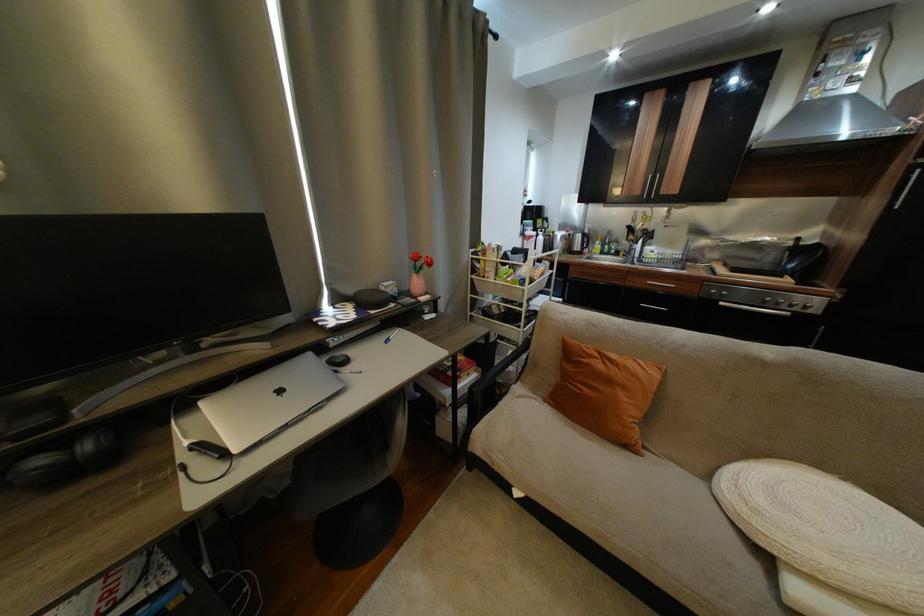
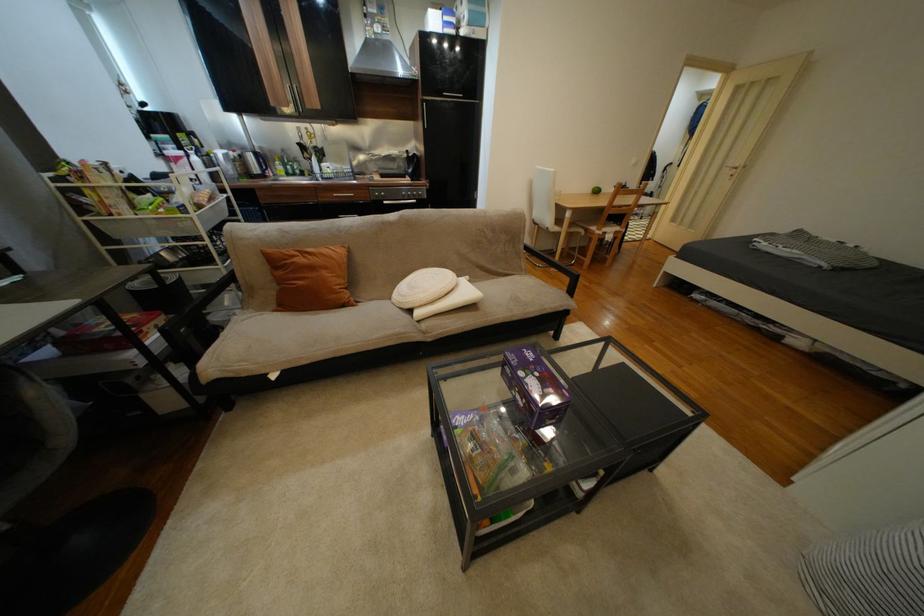
Where in the second image is the point corresponding to the point at 730,305 from the first image?

(393, 204)